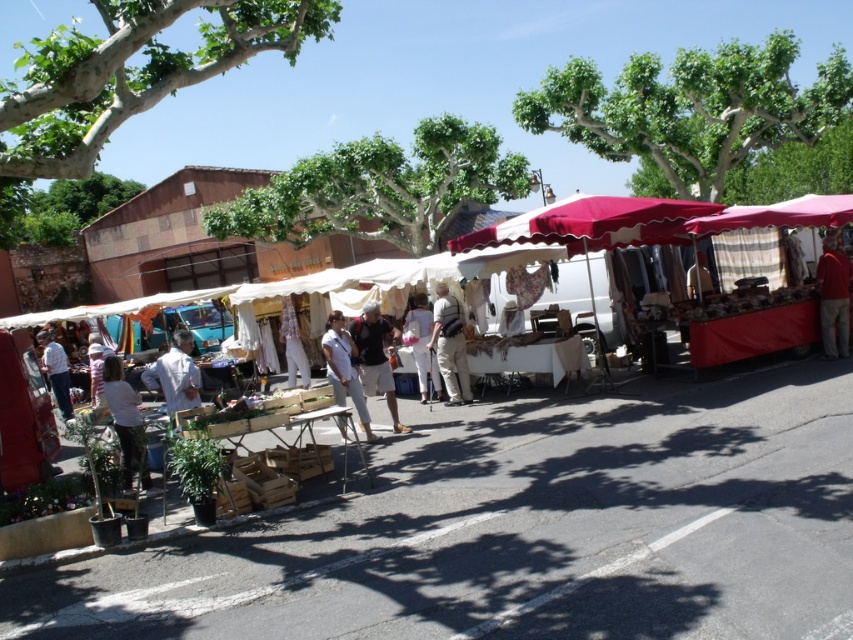
Question: Can you confirm if matte brown backpack at center is thinner than white cotton pants at center?

Choices:
 (A) yes
 (B) no

Answer: (B)

Question: Estimate the real-world distances between objects in this image. Which object is closer to the white cotton dress at center?

Choices:
 (A) light brown leather backpack at center
 (B) white cotton shirt at lower left
 (C) matte brown backpack at center
 (D) white cotton pants at center

Answer: (A)

Question: Where is white cotton shirt at lower left located in relation to light brown leather jacket at left in the image?

Choices:
 (A) right
 (B) left

Answer: (A)

Question: Which object appears farthest from the camera in this image?

Choices:
 (A) light brown leather jacket at left
 (B) wooden crates at center

Answer: (A)

Question: Does light brown leather backpack at center appear on the right side of light brown leather jacket at left?

Choices:
 (A) no
 (B) yes

Answer: (B)

Question: Among these objects, which one is nearest to the camera?

Choices:
 (A) white cotton shirt at lower left
 (B) light brown leather jacket at left
 (C) white cotton pants at center
 (D) wooden crates at center

Answer: (D)